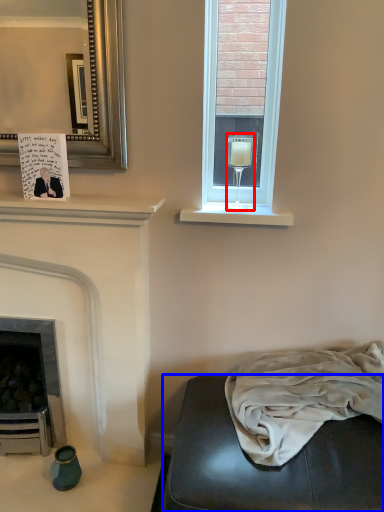
Question: Which point is closer to the camera, wine glass (highlighted by a red box) or studio couch (highlighted by a blue box)?

Choices:
 (A) wine glass
 (B) studio couch

Answer: (B)